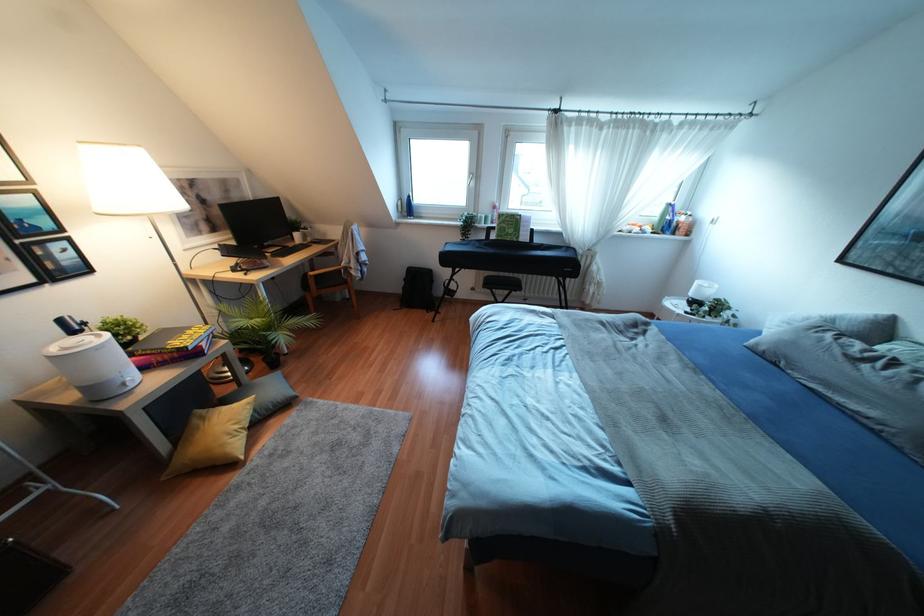
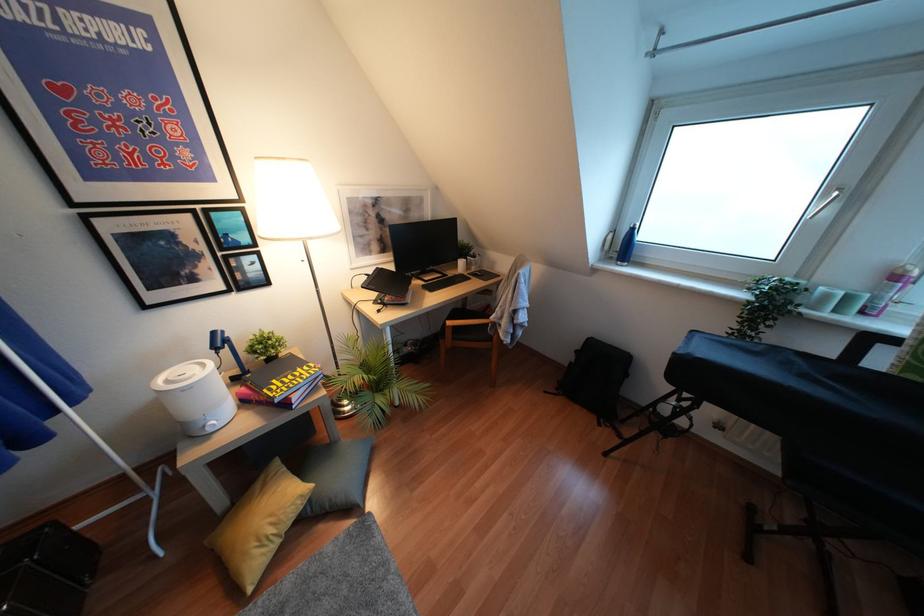
In the second image, find the point that corresponds to the point at 407,208 in the first image.

(623, 246)